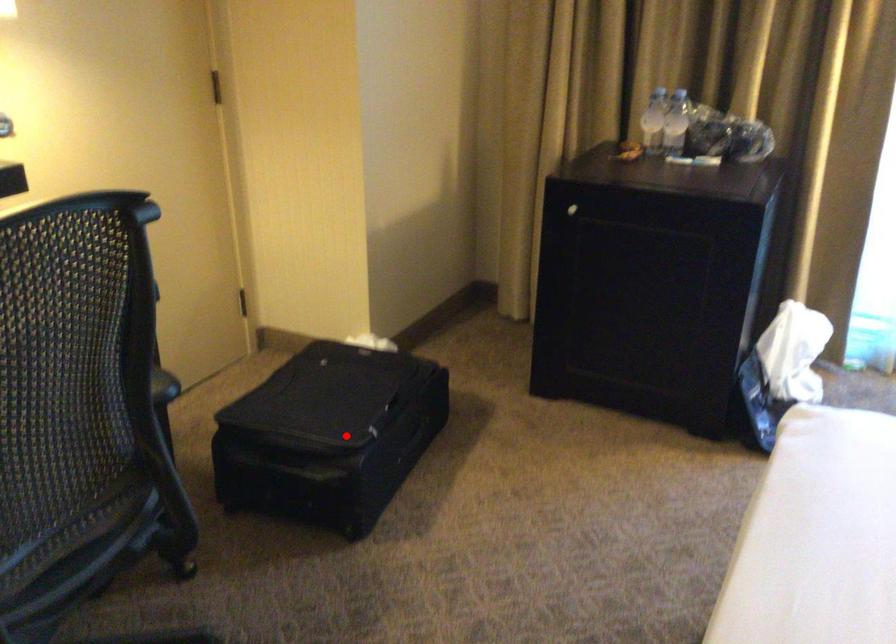
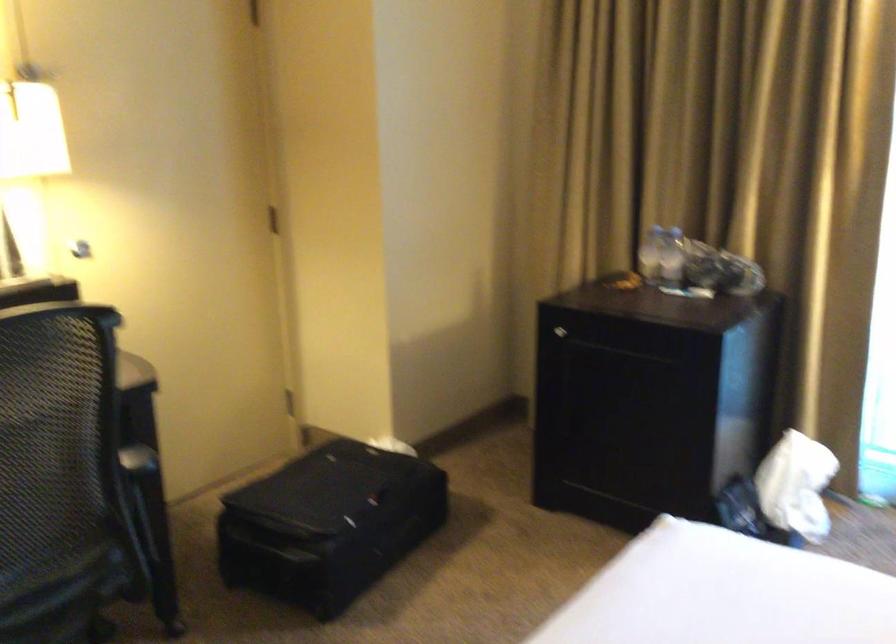
Question: I am providing you with two images of the same scene from different viewpoints. In image1, a red point is highlighted. Considering the same 3D point in image2, which of the following is correct?

Choices:
 (A) It is closer
 (B) It is farther

Answer: (B)